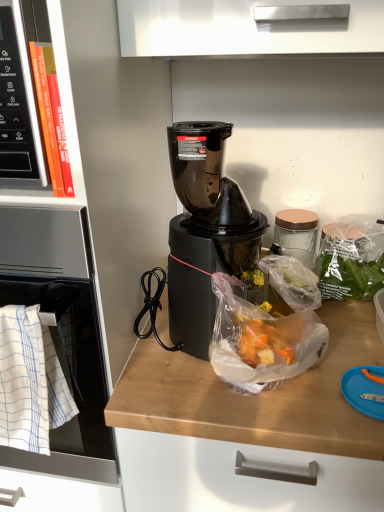
Question: Is white woven towel at left turned away from translucent plastic bag at center?

Choices:
 (A) no
 (B) yes

Answer: (A)

Question: From the image's perspective, is white woven towel at left on translucent plastic bag at center?

Choices:
 (A) no
 (B) yes

Answer: (A)

Question: Is white woven towel at left positioned before translucent plastic bag at center?

Choices:
 (A) no
 (B) yes

Answer: (B)

Question: Is white woven towel at left at the right side of translucent plastic bag at center?

Choices:
 (A) yes
 (B) no

Answer: (B)

Question: Is white woven towel at left aimed at translucent plastic bag at center?

Choices:
 (A) yes
 (B) no

Answer: (B)

Question: In terms of height, does satin silver oven at left look taller or shorter compared to translucent plastic bag at center?

Choices:
 (A) short
 (B) tall

Answer: (B)

Question: Is satin silver oven at left bigger or smaller than translucent plastic bag at center?

Choices:
 (A) small
 (B) big

Answer: (B)

Question: From a real-world perspective, is satin silver oven at left physically located above or below translucent plastic bag at center?

Choices:
 (A) above
 (B) below

Answer: (B)

Question: Looking at their shapes, would you say satin silver oven at left is wider or thinner than translucent plastic bag at center?

Choices:
 (A) wide
 (B) thin

Answer: (A)

Question: Is orange hardcover book at left inside or outside of translucent plastic bag at center?

Choices:
 (A) outside
 (B) inside

Answer: (A)

Question: In terms of size, does orange hardcover book at left appear bigger or smaller than translucent plastic bag at center?

Choices:
 (A) big
 (B) small

Answer: (B)

Question: Looking at their shapes, would you say orange hardcover book at left is wider or thinner than translucent plastic bag at center?

Choices:
 (A) thin
 (B) wide

Answer: (A)

Question: Is orange hardcover book at left in front of or behind translucent plastic bag at center in the image?

Choices:
 (A) front
 (B) behind

Answer: (A)

Question: Is orange hardcover book at left in front of or behind black plastic blender at center in the image?

Choices:
 (A) behind
 (B) front

Answer: (B)

Question: In terms of width, does orange hardcover book at left look wider or thinner when compared to black plastic blender at center?

Choices:
 (A) wide
 (B) thin

Answer: (B)